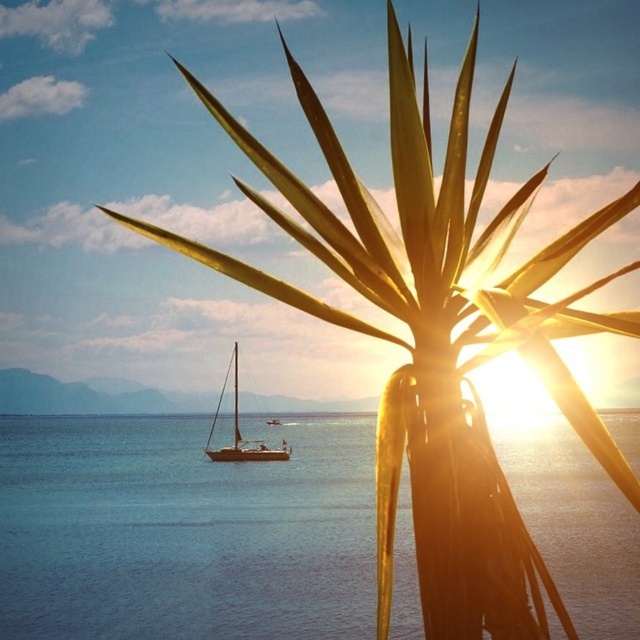
You are standing at the golden sculpture in the foreground of the seascape. Looking towards the point marked at coordinates (182,532), which object do you see there?

The point at coordinates (182,532) indicates blue water at center.